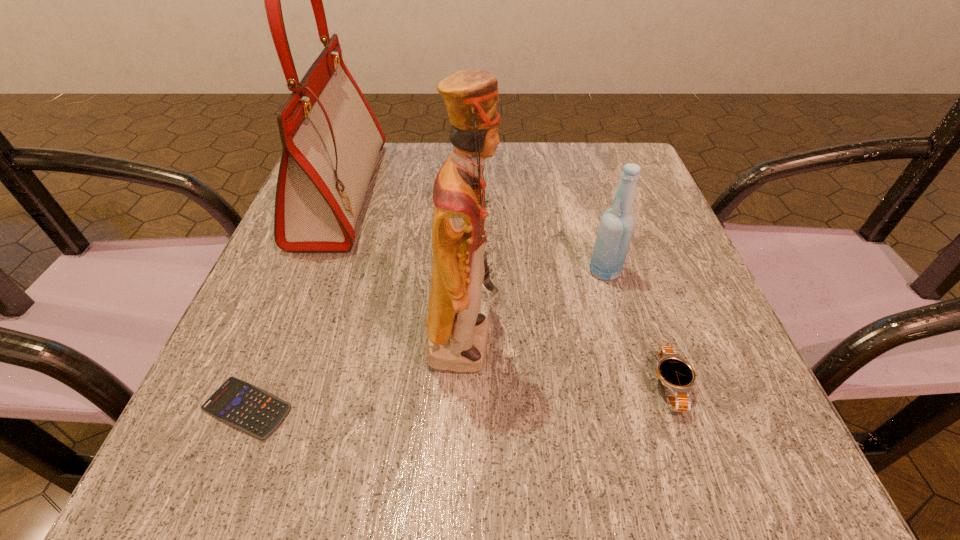
You are a GUI agent. You are given a task and a screenshot of the screen. Output one action in this format:
    pyautogui.click(x=<x>, y=<y>)
    Task: Click on the unoccupied area between the shortest object and the third tallest object
    This screenshot has width=960, height=540.
    Given the screenshot: What is the action you would take?
    pyautogui.click(x=426, y=340)

The image size is (960, 540). In order to click on free space between the handbag and the nutcracker in this screenshot , I will do `click(403, 265)`.

Identify the location of vacant area that lies between the shortest object and the third shortest object. This screenshot has height=540, width=960. (357, 307).

You are a GUI agent. You are given a task and a screenshot of the screen. Output one action in this format:
    pyautogui.click(x=<x>, y=<y>)
    Task: Click on the vacant region between the fifth tallest object and the compass
    This screenshot has width=960, height=540.
    Given the screenshot: What is the action you would take?
    pyautogui.click(x=568, y=296)

The image size is (960, 540). What are the coordinates of `vacant space that is in between the fourth nearest object and the nutcracker` in the screenshot? It's located at (535, 305).

Locate which object ranks second in proximity to the handbag. Please provide its 2D coordinates. Your answer should be formatted as a tuple, i.e. [(x, y)], where the tuple contains the x and y coordinates of a point satisfying the conditions above.

[(457, 334)]

This screenshot has width=960, height=540. Identify the location of object identified as the fifth closest to the bottle. (248, 408).

At what (x,y) coordinates should I click in order to perform the action: click on free space that satisfies the following two spatial constraints: 1. on the back side of the watch; 2. on the left side of the shortest object. Please return your answer as a coordinate pair (x, y). This screenshot has height=540, width=960. Looking at the image, I should click on (256, 386).

The image size is (960, 540). Identify the location of free space that satisfies the following two spatial constraints: 1. on the face of the third shortest object; 2. on the back side of the watch. (461, 386).

Identify the location of vacant area in the image that satisfies the following two spatial constraints: 1. on the back side of the shortest object; 2. on the left side of the handbag. (335, 193).